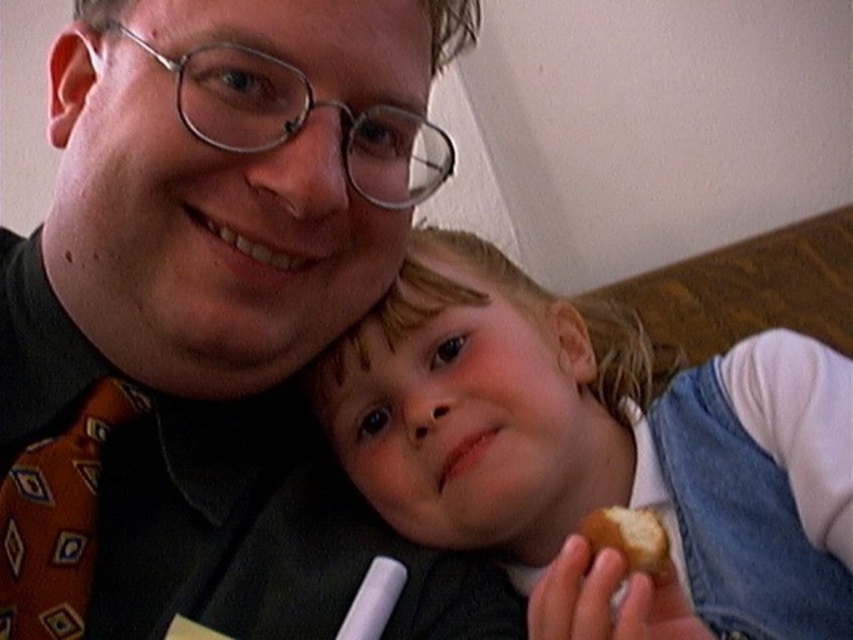
Question: Which is farther from the orange patterned tie at left?

Choices:
 (A) matte black shirt at center
 (B) smooth white shirt at center

Answer: (B)

Question: Can you confirm if matte black shirt at center is positioned to the left of golden crumbly pastry at lower right?

Choices:
 (A) yes
 (B) no

Answer: (A)

Question: Which point is closer to the camera?

Choices:
 (A) orange patterned tie at left
 (B) smooth white shirt at center

Answer: (A)

Question: Can you confirm if matte black shirt at center is positioned above smooth white shirt at center?

Choices:
 (A) no
 (B) yes

Answer: (B)

Question: Which point is farther to the camera?

Choices:
 (A) smooth white shirt at center
 (B) matte black shirt at center
 (C) golden crumbly pastry at lower right
 (D) orange patterned tie at left

Answer: (A)

Question: Is matte black shirt at center to the left of smooth white shirt at center from the viewer's perspective?

Choices:
 (A) yes
 (B) no

Answer: (A)